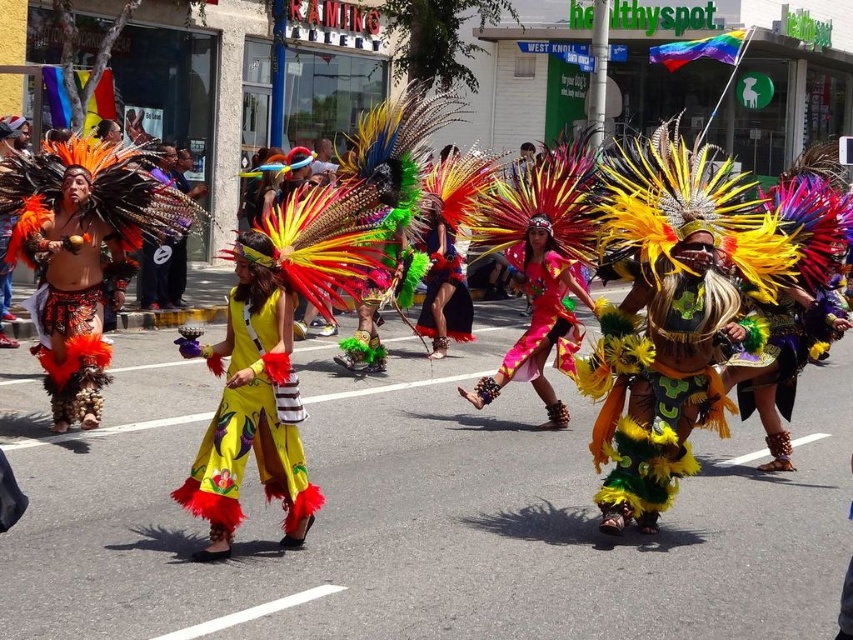
Question: Is yellow satin dress at center closer to the viewer compared to shiny blue fabric skirt at center?

Choices:
 (A) no
 (B) yes

Answer: (B)

Question: Is bright yellow feathered headdress at center above pink satin dress at center?

Choices:
 (A) no
 (B) yes

Answer: (A)

Question: Which point is closer to the camera?

Choices:
 (A) pink satin dress at center
 (B) yellow satin dress at center

Answer: (B)

Question: Is matte yellow costume at center bigger than pink satin dress at center?

Choices:
 (A) no
 (B) yes

Answer: (B)

Question: Among these objects, which one is nearest to the camera?

Choices:
 (A) shiny pink fabric at center
 (B) shiny blue fabric skirt at center

Answer: (A)

Question: Estimate the real-world distances between objects in this image. Which object is farther from the pink satin dress at center?

Choices:
 (A) shiny pink fabric at center
 (B) matte yellow costume at center
 (C) shiny blue fabric skirt at center

Answer: (C)